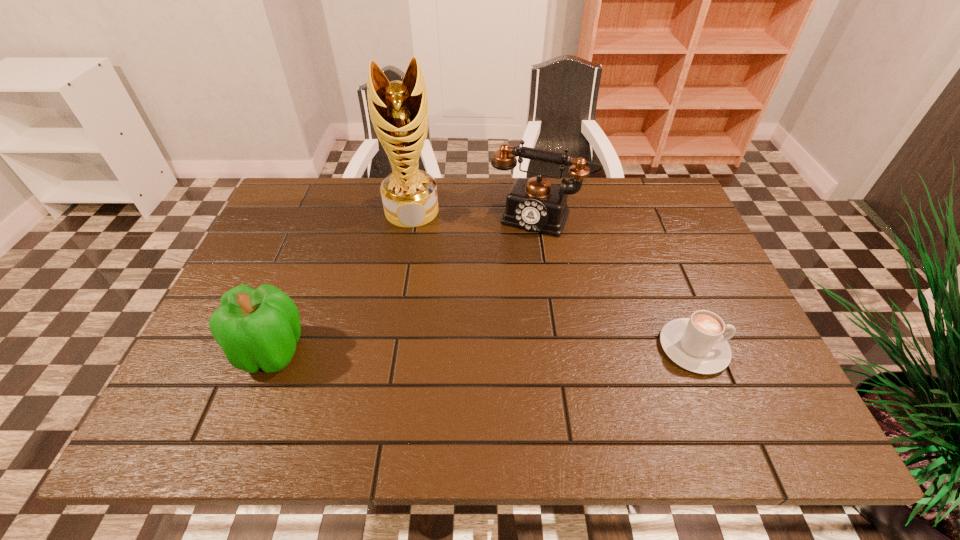
Locate an element on the screen. free space between the award and the third object from left to right is located at coordinates (476, 214).

Find the location of `object identified as the second closest to the award`. object identified as the second closest to the award is located at coordinates (257, 328).

Locate an element on the screen. The height and width of the screenshot is (540, 960). object that is the closest to the second shortest object is located at coordinates (399, 111).

I want to click on vacant space that satisfies the following two spatial constraints: 1. on the back side of the rightmost object; 2. to the right of the second shortest object, so click(x=275, y=348).